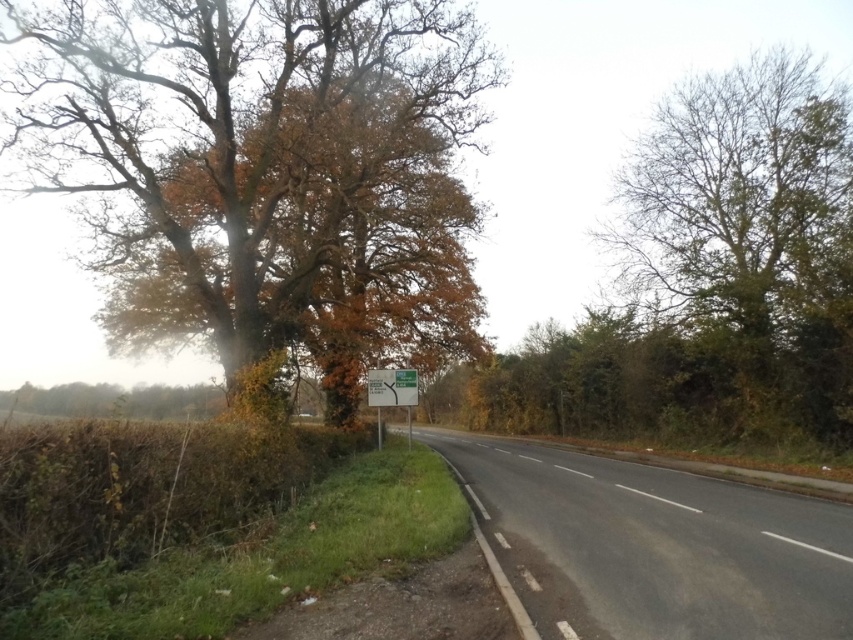
Which is behind, point (839, 321) or point (498, 499)?

Positioned behind is point (839, 321).

Is bare branches tree at right taller than black asphalt highway at center?

Indeed, bare branches tree at right has a greater height compared to black asphalt highway at center.

Is point (811, 90) positioned after point (540, 563)?

Yes, it is.

Identify the location of bare branches tree at right. pyautogui.click(x=749, y=243).

Can you confirm if autumn leaves wood at left is positioned to the right of green plastic sign at center?

No, autumn leaves wood at left is not to the right of green plastic sign at center.

Does autumn leaves wood at left have a smaller size compared to green plastic sign at center?

Incorrect, autumn leaves wood at left is not smaller in size than green plastic sign at center.

Does point (71, 61) come farther from viewer compared to point (415, 388)?

No, (71, 61) is closer to viewer.

Where is `autumn leaves wood at left`? autumn leaves wood at left is located at coordinates (263, 172).

Can you confirm if white plastic sign at center is positioned to the right of green plastic sign at center?

Correct, you'll find white plastic sign at center to the right of green plastic sign at center.

Image resolution: width=853 pixels, height=640 pixels. What do you see at coordinates (393, 390) in the screenshot? I see `white plastic sign at center` at bounding box center [393, 390].

Between point (416, 394) and point (393, 397), which one is positioned behind?

The point (416, 394) is behind.

You are a GUI agent. You are given a task and a screenshot of the screen. Output one action in this format:
    pyautogui.click(x=<x>, y=<y>)
    Task: Click on the white plastic sign at center
    The height and width of the screenshot is (640, 853).
    Given the screenshot: What is the action you would take?
    pyautogui.click(x=393, y=390)